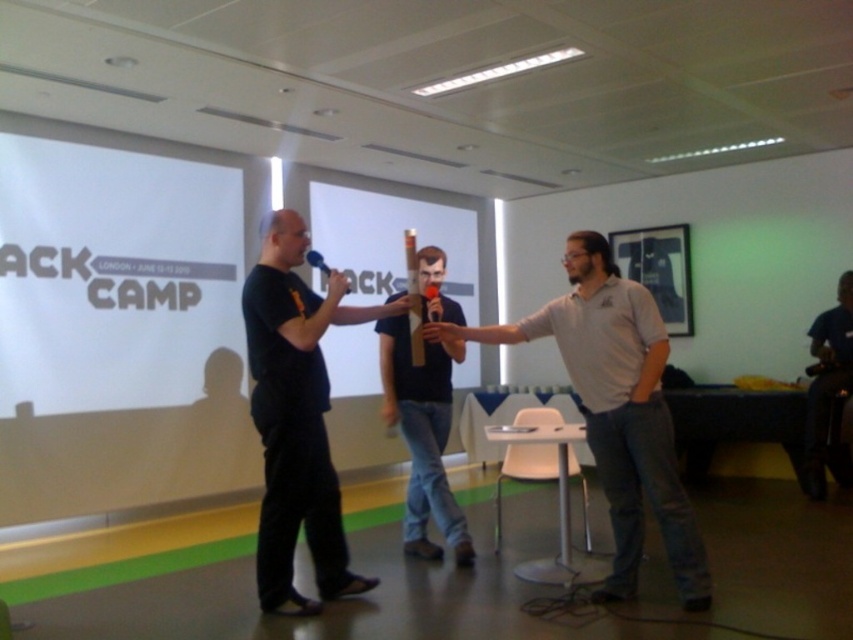
Who is shorter, gray cotton shirt at center or black matte t-shirt at center?

gray cotton shirt at center is shorter.

Does gray cotton shirt at center have a lesser width compared to black matte t-shirt at center?

No.

Who is more distant from viewer, (x=642, y=349) or (x=434, y=493)?

Point (x=434, y=493)

Image resolution: width=853 pixels, height=640 pixels. In order to click on gray cotton shirt at center in this screenshot , I will do `click(616, 408)`.

Describe the element at coordinates (616, 408) in the screenshot. I see `gray cotton shirt at center` at that location.

At what (x,y) coordinates should I click in order to perform the action: click on gray cotton shirt at center. Please return your answer as a coordinate pair (x, y). The height and width of the screenshot is (640, 853). Looking at the image, I should click on (616, 408).

Which is in front, point (268, 339) or point (461, 317)?

Point (268, 339)

Consider the image. Can you confirm if black matte shirt at center is smaller than black matte t-shirt at center?

Indeed, black matte shirt at center has a smaller size compared to black matte t-shirt at center.

Who is more distant from viewer, (277,397) or (401,396)?

Positioned behind is point (401,396).

This screenshot has width=853, height=640. In order to click on black matte shirt at center in this screenshot , I will do `click(296, 417)`.